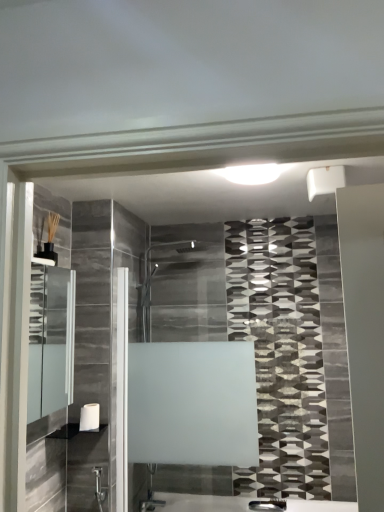
Measure the distance between point (59,288) and camera.

The depth of point (59,288) is 6.17 feet.

Measure the distance between point (50,435) and camera.

The distance of point (50,435) from camera is 7.14 feet.

This screenshot has height=512, width=384. Find the location of `white matte towel bar at lower left`. white matte towel bar at lower left is located at coordinates (90, 417).

Which is behind, point (71, 431) or point (86, 428)?

Point (71, 431)

Identify the location of shelf located in front of the white matte towel bar at lower left. The width and height of the screenshot is (384, 512). (65, 432).

Is white glossy shelf at lower left positioned behind white matte towel bar at lower left?

No.

Is white glossy shelf at lower left inside the boundaries of white matte towel bar at lower left, or outside?

white glossy shelf at lower left is located beyond the bounds of white matte towel bar at lower left.

Relative to clear glass medicine cabinet at left, is white matte towel bar at lower left in front or behind?

Visually, white matte towel bar at lower left is located behind clear glass medicine cabinet at left.

Can you tell me how much white matte towel bar at lower left and clear glass medicine cabinet at left differ in facing direction?

0.000931 degrees separate the facing orientations of white matte towel bar at lower left and clear glass medicine cabinet at left.

Considering the sizes of objects white matte towel bar at lower left and clear glass medicine cabinet at left in the image provided, who is thinner, white matte towel bar at lower left or clear glass medicine cabinet at left?

Thinner between the two is white matte towel bar at lower left.

From a real-world perspective, does white matte towel bar at lower left sit lower than clear glass medicine cabinet at left?

→ Yes, from a real-world perspective, white matte towel bar at lower left is below clear glass medicine cabinet at left.

Is clear glass medicine cabinet at left not close to white glossy shelf at lower left?

No, clear glass medicine cabinet at left is not far from white glossy shelf at lower left.

Is clear glass medicine cabinet at left oriented away from white glossy shelf at lower left?

No.

At what (x,y) coordinates should I click in order to perform the action: click on shelf directly beneath the clear glass medicine cabinet at left (from a real-world perspective). Please return your answer as a coordinate pair (x, y). This screenshot has width=384, height=512. Looking at the image, I should click on (65, 432).

Which object is closer to the camera, clear glass medicine cabinet at left or white matte towel bar at lower left?

clear glass medicine cabinet at left.

Is clear glass medicine cabinet at left facing towards white matte towel bar at lower left?

No, clear glass medicine cabinet at left does not turn towards white matte towel bar at lower left.

Is clear glass medicine cabinet at left not inside white matte towel bar at lower left?

Yes, clear glass medicine cabinet at left is outside of white matte towel bar at lower left.

Is clear glass medicine cabinet at left shorter than white matte towel bar at lower left?

No.

Does white glossy shelf at lower left have a smaller size compared to clear glass medicine cabinet at left?

Indeed, white glossy shelf at lower left has a smaller size compared to clear glass medicine cabinet at left.

Does white glossy shelf at lower left come behind clear glass medicine cabinet at left?

Yes, it is behind clear glass medicine cabinet at left.

Visually, is white glossy shelf at lower left positioned to the left or to the right of clear glass medicine cabinet at left?

white glossy shelf at lower left is positioned on clear glass medicine cabinet at left's right side.

Is white glossy shelf at lower left far away from clear glass medicine cabinet at left?

white glossy shelf at lower left is near clear glass medicine cabinet at left, not far away.

How different are the orientations of white matte towel bar at lower left and white glossy shelf at lower left in degrees?

The angular difference between white matte towel bar at lower left and white glossy shelf at lower left is 0.0021 degrees.

Which object is positioned more to the left, white matte towel bar at lower left or white glossy shelf at lower left?

From the viewer's perspective, white glossy shelf at lower left appears more on the left side.

From a real-world perspective, who is located higher, white matte towel bar at lower left or white glossy shelf at lower left?

In real-world perspective, white matte towel bar at lower left is above.

In order to click on towel bar behind the white glossy shelf at lower left in this screenshot , I will do `click(90, 417)`.

This screenshot has width=384, height=512. Identify the location of medicine cabinet in front of the white matte towel bar at lower left. (52, 345).

From the image, which object appears to be nearer to white glossy shelf at lower left, clear glass medicine cabinet at left or white matte towel bar at lower left?

Among the two, white matte towel bar at lower left is located nearer to white glossy shelf at lower left.

Based on their spatial positions, is white matte towel bar at lower left or white glossy shelf at lower left closer to clear glass medicine cabinet at left?

white matte towel bar at lower left.

Based on their spatial positions, is white glossy shelf at lower left or white matte towel bar at lower left further from clear glass medicine cabinet at left?

white glossy shelf at lower left.

From the image, which object appears to be farther from white matte towel bar at lower left, clear glass medicine cabinet at left or white glossy shelf at lower left?

clear glass medicine cabinet at left is further to white matte towel bar at lower left.

Based on their spatial positions, is white glossy shelf at lower left or clear glass medicine cabinet at left closer to white matte towel bar at lower left?

white glossy shelf at lower left is positioned closer to the anchor white matte towel bar at lower left.

When comparing their distances from white glossy shelf at lower left, does white matte towel bar at lower left or clear glass medicine cabinet at left seem closer?

white matte towel bar at lower left is closer to white glossy shelf at lower left.

Where is `shelf positioned between clear glass medicine cabinet at left and white matte towel bar at lower left from near to far`? The image size is (384, 512). shelf positioned between clear glass medicine cabinet at left and white matte towel bar at lower left from near to far is located at coordinates (65, 432).